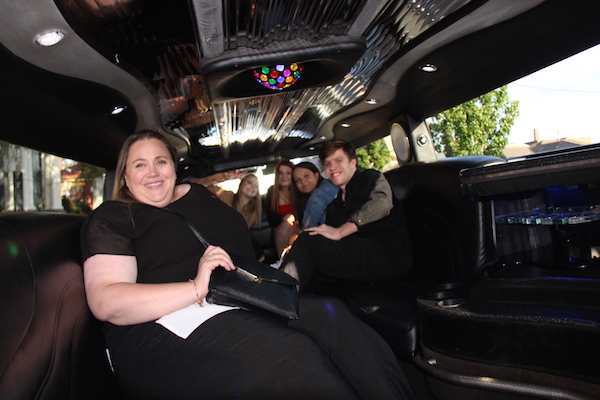
At what (x,y) coordinates should I click in order to perform the action: click on circle lights. Please return your answer as a coordinate pair (x, y). The height and width of the screenshot is (400, 600). Looking at the image, I should click on (54, 36), (120, 109), (430, 67), (374, 99), (347, 125), (325, 137), (182, 159), (313, 148), (187, 169).